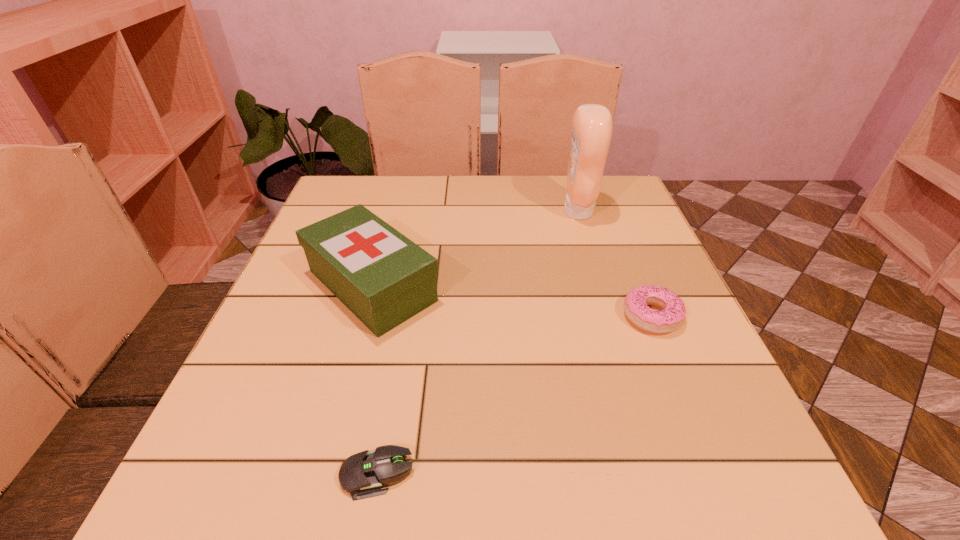
Locate an element on the screen. The width and height of the screenshot is (960, 540). blank space located on the left of the third tallest object is located at coordinates (515, 316).

The image size is (960, 540). I want to click on free space located 0.190m on the right of the computer mouse, so click(541, 474).

This screenshot has width=960, height=540. What are the coordinates of `object located in the far edge section of the desktop` in the screenshot? It's located at (592, 126).

Image resolution: width=960 pixels, height=540 pixels. In order to click on object at the near edge in this screenshot , I will do `click(362, 475)`.

This screenshot has width=960, height=540. I want to click on object present at the left edge, so click(x=381, y=276).

Image resolution: width=960 pixels, height=540 pixels. Find the location of `condiment that is at the right edge`. condiment that is at the right edge is located at coordinates (592, 126).

Find the location of a particular element. doughnut positioned at the right edge is located at coordinates (671, 316).

The height and width of the screenshot is (540, 960). Find the location of `object that is at the far right corner`. object that is at the far right corner is located at coordinates (592, 126).

Image resolution: width=960 pixels, height=540 pixels. In the image, there is a desktop. What are the coordinates of `vacant region at the far edge` in the screenshot? It's located at (497, 205).

This screenshot has height=540, width=960. In the image, there is a desktop. Find the location of `vacant region at the near edge`. vacant region at the near edge is located at coordinates (455, 469).